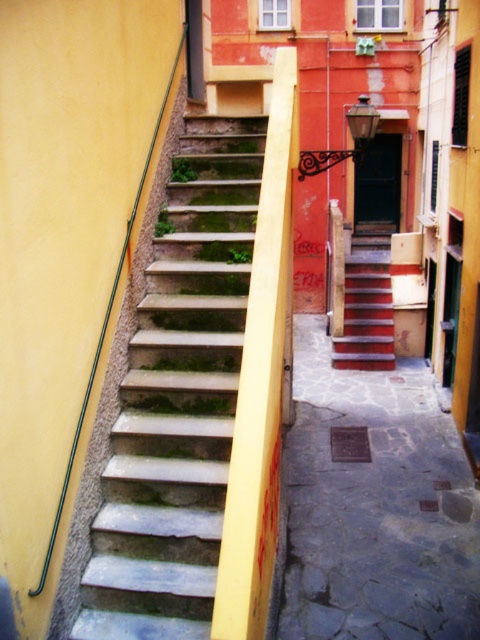
Looking at this image, does stone steps at left have a lesser width compared to wooden stairs at center?

Yes.

Is the position of stone steps at left less distant than that of wooden stairs at center?

Yes, it is.

Identify the location of stone steps at left. The height and width of the screenshot is (640, 480). (178, 397).

Locate an element on the screen. This screenshot has width=480, height=640. stone steps at left is located at coordinates (178, 397).

Is stone steps at left below smooth stone alley at center?

Incorrect, stone steps at left is not positioned below smooth stone alley at center.

Does point (228, 384) lie in front of point (374, 579)?

Yes, it is in front of point (374, 579).

Does point (164, 323) come in front of point (311, 561)?

Yes, point (164, 323) is closer to viewer.

Locate an element on the screen. stone steps at left is located at coordinates (178, 397).

Can you confirm if smooth stone alley at center is smaller than wooden stairs at center?

Yes.

Is point (372, 502) behind point (349, 360)?

No, (372, 502) is closer to viewer.

Where is `smooth stone alley at center`? The image size is (480, 640). smooth stone alley at center is located at coordinates (376, 508).